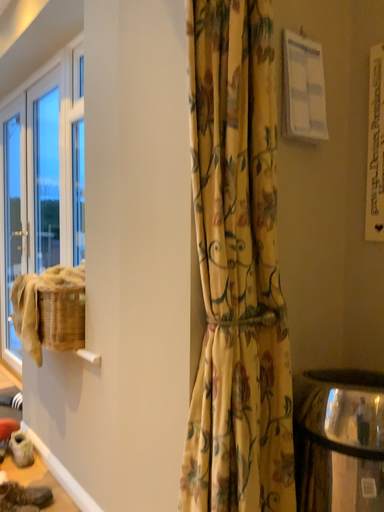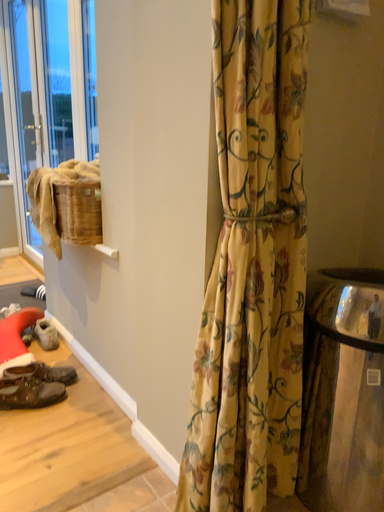
Question: How did the camera likely rotate when shooting the video?

Choices:
 (A) rotated upward
 (B) rotated downward

Answer: (B)